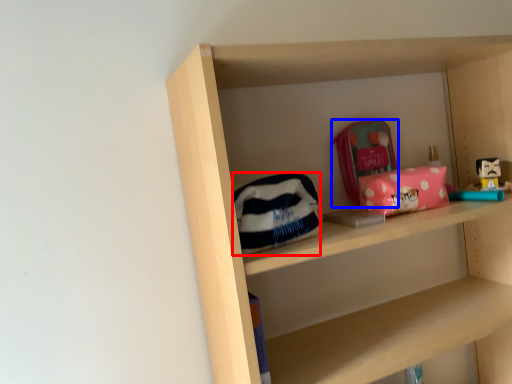
Question: Which object appears closest to the camera in this image, pouch (highlighted by a red box) or pouch (highlighted by a blue box)?

Choices:
 (A) pouch
 (B) pouch

Answer: (A)